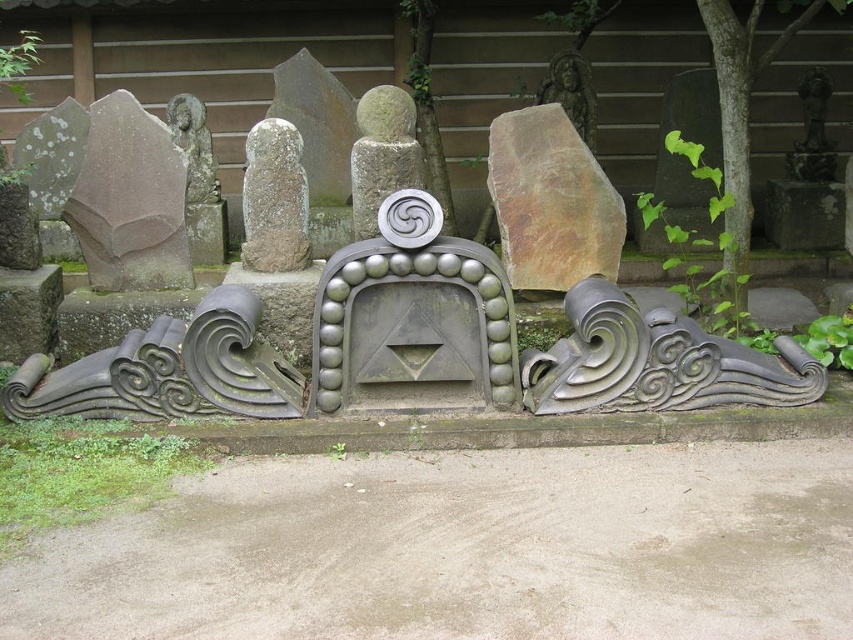
Question: Is black stone wave at right above bronze statue at upper right?

Choices:
 (A) no
 (B) yes

Answer: (A)

Question: Which of the following is the farthest from the observer?

Choices:
 (A) (819, 74)
 (B) (286, 157)
 (C) (711, 333)

Answer: (A)

Question: Is polished stone carving at center in front of smooth gray stone at center?

Choices:
 (A) yes
 (B) no

Answer: (A)

Question: Is smooth gray stone at center smaller than rustic stone statue at upper center?

Choices:
 (A) yes
 (B) no

Answer: (A)

Question: Estimate the real-world distances between objects in this image. Which object is farther from the polished stone carving at center?

Choices:
 (A) black stone wave at right
 (B) rustic stone statue at upper center
 (C) green stone statue at upper left
 (D) bronze statue at upper right

Answer: (D)

Question: Which point is farther from the camera taking this photo?

Choices:
 (A) (252, 204)
 (B) (194, 188)
 (C) (399, 184)

Answer: (B)